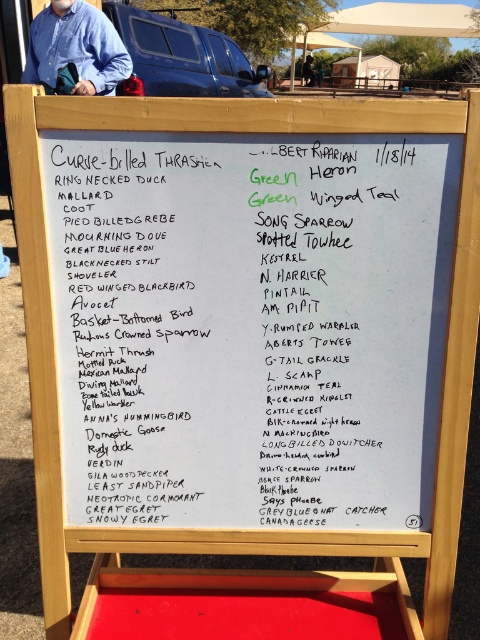
You are standing in front of the whiteboard on the wooden easel and want to reach the green paper at upper center to write a note. Can you comfortably reach it without needing a stool?

The green paper at upper center is 4.29 feet away from viewer, so yes, you can comfortably reach it without needing a stool since it is within typical arm reach distance.

From the picture: You are a customer at an outdoor event and want to read both the white paperboard menu at upper center and the blue cotton shirt at upper left. Which object is narrower?

The white paperboard menu at upper center is narrower than the blue cotton shirt at upper left.

You are a hiker who wants to take a photo of the white paperboard menu at upper center and the blue cotton shirt at upper left. Which object should you focus on first if you want to capture both in the same frame without moving the camera?

The white paperboard menu at upper center is smaller than the blue cotton shirt at upper left, so you should focus on the blue cotton shirt at upper left first to ensure it fits properly in the frame.